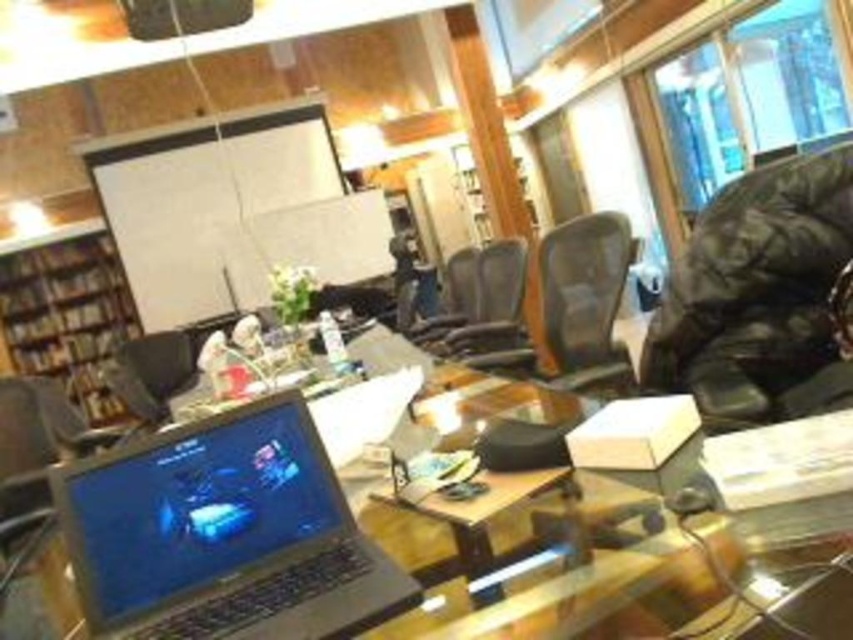
Question: Which object appears closest to the camera in this image?

Choices:
 (A) matte black chair at center
 (B) leather swivel chair at right
 (C) brown wooden bookshelf at left

Answer: (B)

Question: Is leather swivel chair at right to the left of brown wooden bookshelf at left from the viewer's perspective?

Choices:
 (A) yes
 (B) no

Answer: (B)

Question: Which is nearer to the satin black laptop at lower left?

Choices:
 (A) brown wooden bookshelf at left
 (B) black leather chair at center
 (C) matte black chair at center
 (D) leather swivel chair at right

Answer: (D)

Question: Does brown wooden bookshelf at left have a greater width compared to black mesh office chair at center?

Choices:
 (A) no
 (B) yes

Answer: (B)

Question: Which point appears farthest from the camera in this image?

Choices:
 (A) (585, 284)
 (B) (445, 296)
 (C) (341, 554)
 (D) (47, 280)

Answer: (D)

Question: Can you confirm if satin black laptop at lower left is positioned above matte black chair at center?

Choices:
 (A) yes
 (B) no

Answer: (A)